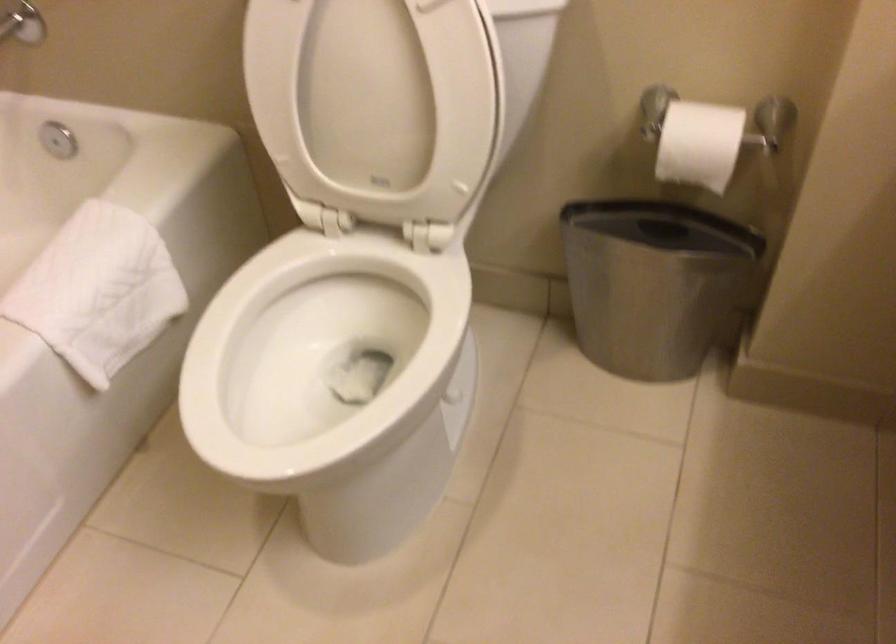
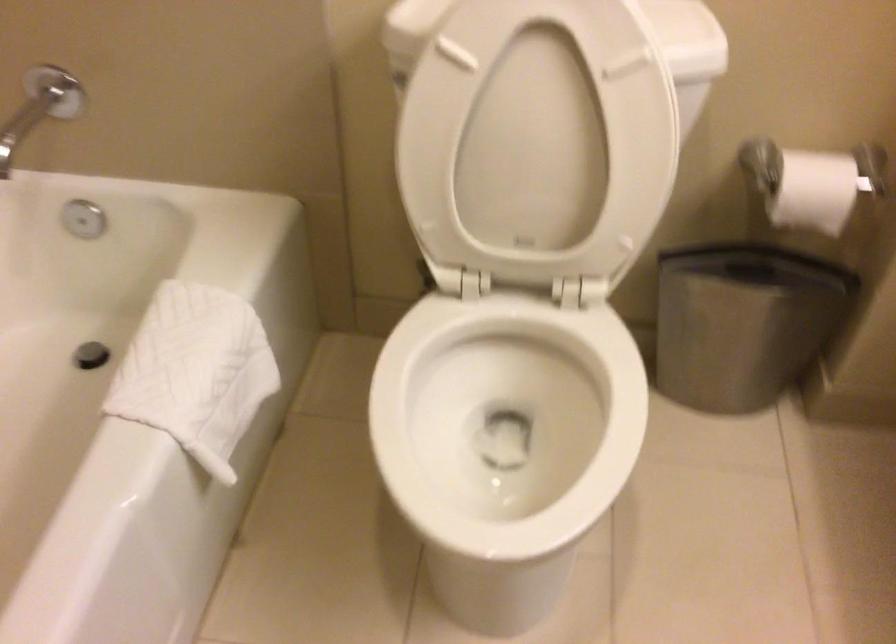
Find the pixel in the second image that matches point 691,142 in the first image.

(812, 183)